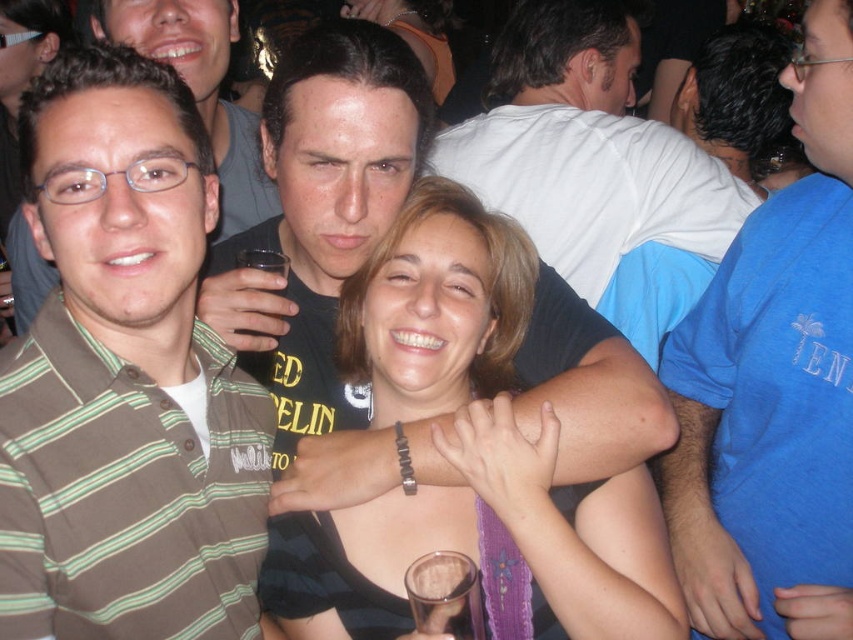
Who is taller, white cotton shirt at upper center or matte brown shirt at left?

With more height is white cotton shirt at upper center.

Does white cotton shirt at upper center have a greater width compared to matte brown shirt at left?

Yes, white cotton shirt at upper center is wider than matte brown shirt at left.

Is point (523, 93) positioned in front of point (216, 16)?

No.

Find the location of a particular element. The height and width of the screenshot is (640, 853). white cotton shirt at upper center is located at coordinates (596, 168).

Does point (368, 266) come closer to viewer compared to point (612, 372)?

No, (368, 266) is behind (612, 372).

Locate an element on the screen. Image resolution: width=853 pixels, height=640 pixels. smooth black tank top at center is located at coordinates (468, 458).

Who is higher up, blue cotton shirt at right or white cotton shirt at upper center?

Positioned higher is white cotton shirt at upper center.

Measure the distance between point (782, 384) and camera.

Point (782, 384) is 1.16 meters away from camera.

Does point (701, 310) lie behind point (537, 164)?

No, it is in front of (537, 164).

Where is `blue cotton shirt at right`? Image resolution: width=853 pixels, height=640 pixels. blue cotton shirt at right is located at coordinates (775, 387).